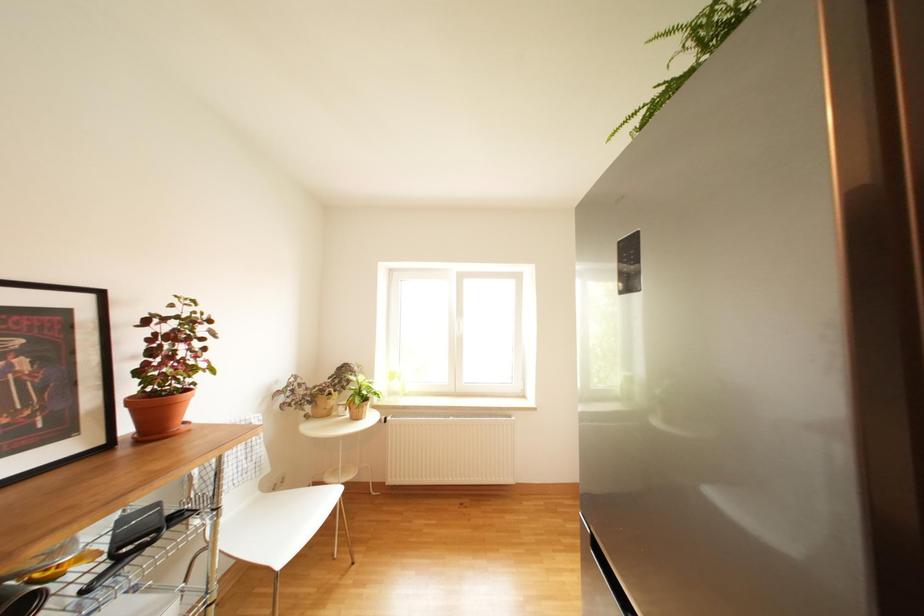
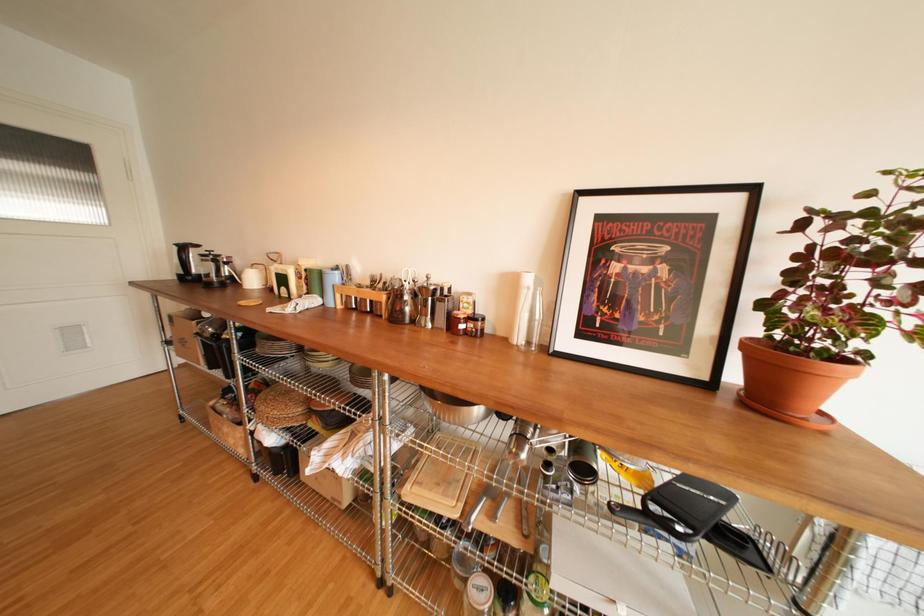
Question: The first image is from the beginning of the video and the second image is from the end. How did the camera likely rotate when shooting the video?

Choices:
 (A) Left
 (B) Right
 (C) Up
 (D) Down

Answer: (A)